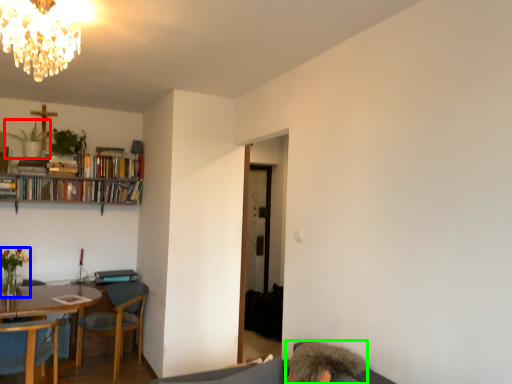
Question: Which object is positioned closest to plant (highlighted by a red box)? Select from houseplant (highlighted by a blue box) and person (highlighted by a green box).

Choices:
 (A) houseplant
 (B) person

Answer: (A)